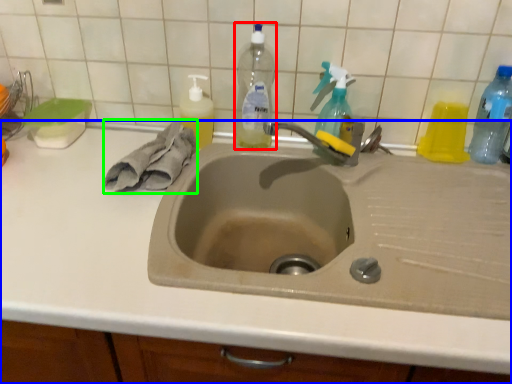
Question: Which object is the farthest from bottle (highlighted by a red box)? Choose among these: countertop (highlighted by a blue box) or hand towel (highlighted by a green box).

Choices:
 (A) countertop
 (B) hand towel

Answer: (A)